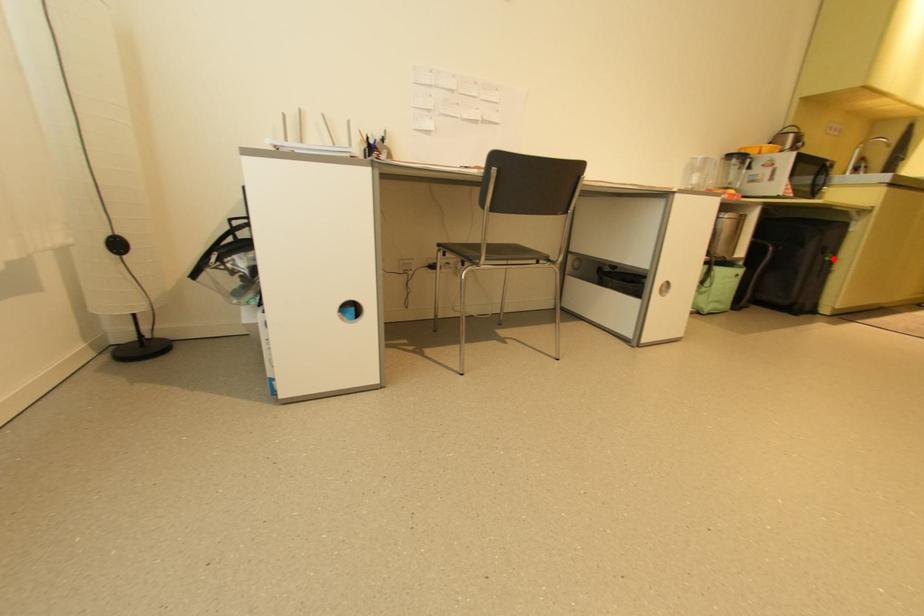
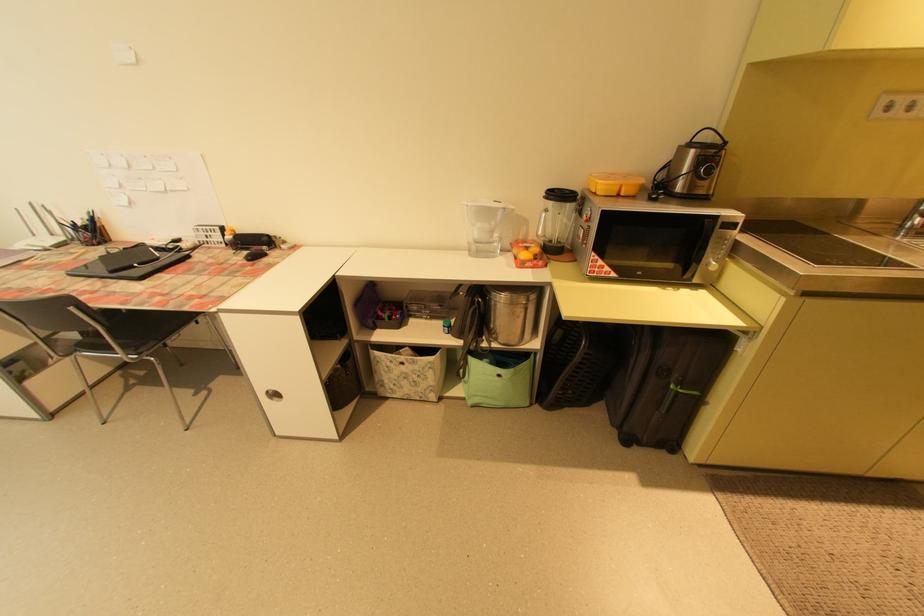
Question: I am providing you with two images of the same scene from different viewpoints. In image1, a red point is highlighted. Considering the same 3D point in image2, which of the following is correct?

Choices:
 (A) It is closer
 (B) It is farther

Answer: (A)